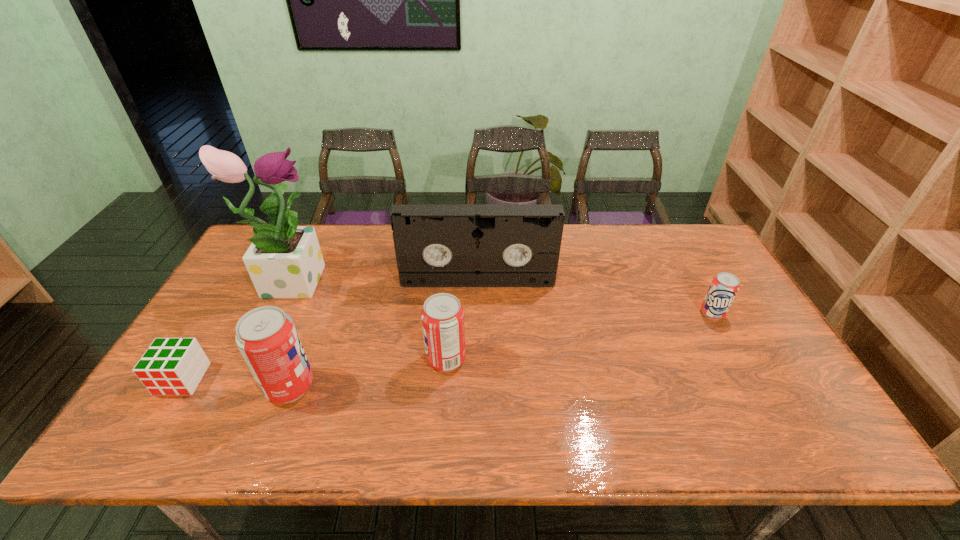
Identify the location of free space that satisfies the following two spatial constraints: 1. on the front-facing side of the leftmost soda can; 2. on the left side of the flower arrangement. Image resolution: width=960 pixels, height=540 pixels. (240, 387).

The height and width of the screenshot is (540, 960). I want to click on vacant point that satisfies the following two spatial constraints: 1. on the front-facing side of the tallest object; 2. on the right side of the second tallest soda can, so click(253, 360).

At what (x,y) coordinates should I click in order to perform the action: click on free location that satisfies the following two spatial constraints: 1. on the front-facing side of the flower arrangement; 2. on the right side of the rightmost object. Please return your answer as a coordinate pair (x, y). Looking at the image, I should click on (276, 313).

What are the coordinates of `blank area in the image that satisfies the following two spatial constraints: 1. on the back side of the shortest soda can; 2. on the front-facing side of the flower arrangement` in the screenshot? It's located at [693, 278].